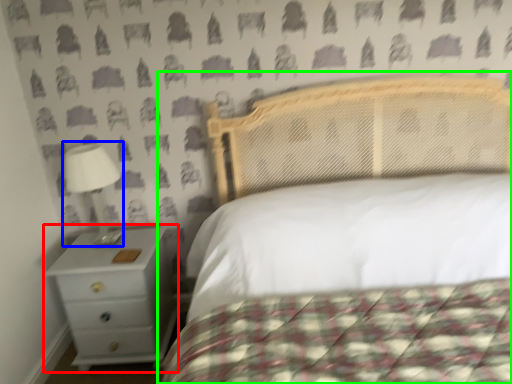
Question: Which object is positioned closest to nightstand (highlighted by a red box)? Select from lamp (highlighted by a blue box) and bed (highlighted by a green box).

Choices:
 (A) lamp
 (B) bed

Answer: (A)